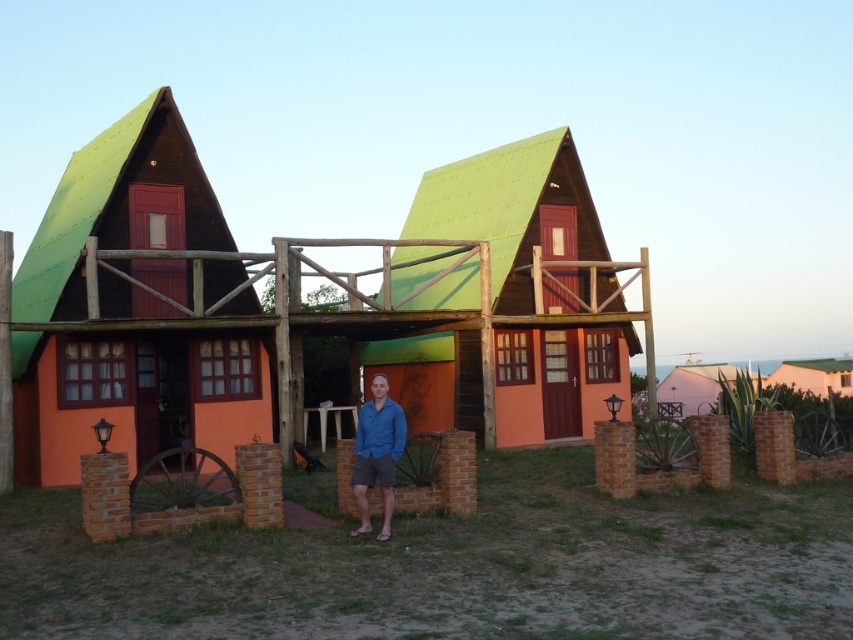
Is matte orange wood hut at center thinner than blue cotton shirt at center?

Incorrect, matte orange wood hut at center's width is not less than blue cotton shirt at center's.

Based on the photo, is matte orange wood hut at center bigger than blue cotton shirt at center?

Yes, matte orange wood hut at center is bigger than blue cotton shirt at center.

This screenshot has width=853, height=640. Identify the location of matte orange wood hut at center. (512, 209).

Locate an element on the screen. matte orange wood hut at center is located at coordinates (512, 209).

Can you confirm if blue cotton shirt at center is positioned below white matte hut at lower right?

Incorrect, blue cotton shirt at center is not positioned below white matte hut at lower right.

Can you confirm if blue cotton shirt at center is bigger than white matte hut at lower right?

No, blue cotton shirt at center is not bigger than white matte hut at lower right.

Find the location of a particular element. This screenshot has width=853, height=640. blue cotton shirt at center is located at coordinates (376, 452).

Who is positioned more to the left, matte orange cabin at left or white matte hut at lower right?

Positioned to the left is matte orange cabin at left.

Does matte orange cabin at left appear under white matte hut at lower right?

Incorrect, matte orange cabin at left is not positioned below white matte hut at lower right.

You are a GUI agent. You are given a task and a screenshot of the screen. Output one action in this format:
    pyautogui.click(x=<x>, y=<y>)
    Task: Click on the matte orange cabin at left
    Image resolution: width=853 pixels, height=640 pixels.
    Given the screenshot: What is the action you would take?
    pyautogui.click(x=131, y=394)